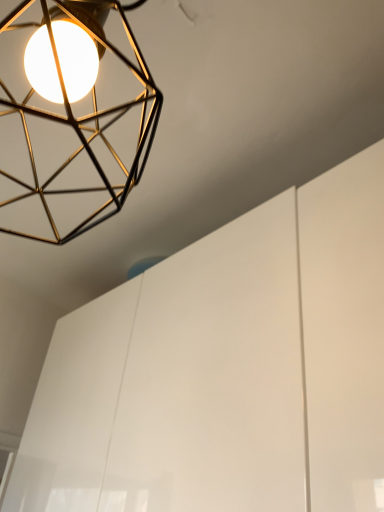
Question: Does gold wireframe lamp at upper left have a lesser height compared to white glossy cabinet at upper center?

Choices:
 (A) yes
 (B) no

Answer: (A)

Question: Does gold wireframe lamp at upper left have a greater height compared to white glossy cabinet at upper center?

Choices:
 (A) yes
 (B) no

Answer: (B)

Question: Considering the relative sizes of gold wireframe lamp at upper left and white glossy cabinet at upper center in the image provided, is gold wireframe lamp at upper left thinner than white glossy cabinet at upper center?

Choices:
 (A) yes
 (B) no

Answer: (A)

Question: Is gold wireframe lamp at upper left facing towards white glossy cabinet at upper center?

Choices:
 (A) yes
 (B) no

Answer: (B)

Question: Is gold wireframe lamp at upper left at the right side of white glossy cabinet at upper center?

Choices:
 (A) yes
 (B) no

Answer: (B)

Question: Is gold wireframe lamp at upper left in front of white glossy cabinet at upper center?

Choices:
 (A) no
 (B) yes

Answer: (B)

Question: Is white glossy cabinet at upper center not near gold wireframe lamp at upper left?

Choices:
 (A) no
 (B) yes

Answer: (A)

Question: Does white glossy cabinet at upper center have a larger size compared to gold wireframe lamp at upper left?

Choices:
 (A) no
 (B) yes

Answer: (B)

Question: Is white glossy cabinet at upper center to the left of gold wireframe lamp at upper left from the viewer's perspective?

Choices:
 (A) no
 (B) yes

Answer: (A)

Question: Is white glossy cabinet at upper center taller than gold wireframe lamp at upper left?

Choices:
 (A) no
 (B) yes

Answer: (B)

Question: Does white glossy cabinet at upper center lie behind gold wireframe lamp at upper left?

Choices:
 (A) no
 (B) yes

Answer: (B)

Question: Is white glossy cabinet at upper center turned away from gold wireframe lamp at upper left?

Choices:
 (A) yes
 (B) no

Answer: (B)

Question: Considering the positions of white glossy cabinet at upper center and gold wireframe lamp at upper left in the image, is white glossy cabinet at upper center bigger or smaller than gold wireframe lamp at upper left?

Choices:
 (A) small
 (B) big

Answer: (B)